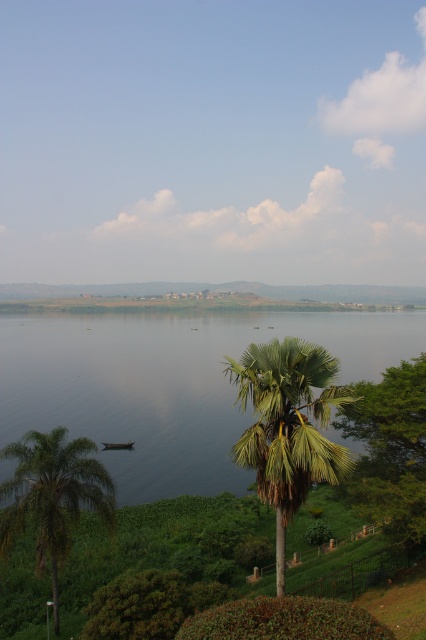
You are standing on the lakeside and want to take a photo of the dark green wooden boat at lower left without the green leafy palm tree at lower left blocking the view. Is this possible?

The green leafy palm tree at lower left is positioned over the dark green wooden boat at lower left, so it will block the view. To take a photo without the palm tree blocking the boat, you would need to move to a position where the palm tree is not between you and the boat, perhaps by moving around to the side or behind the tree.